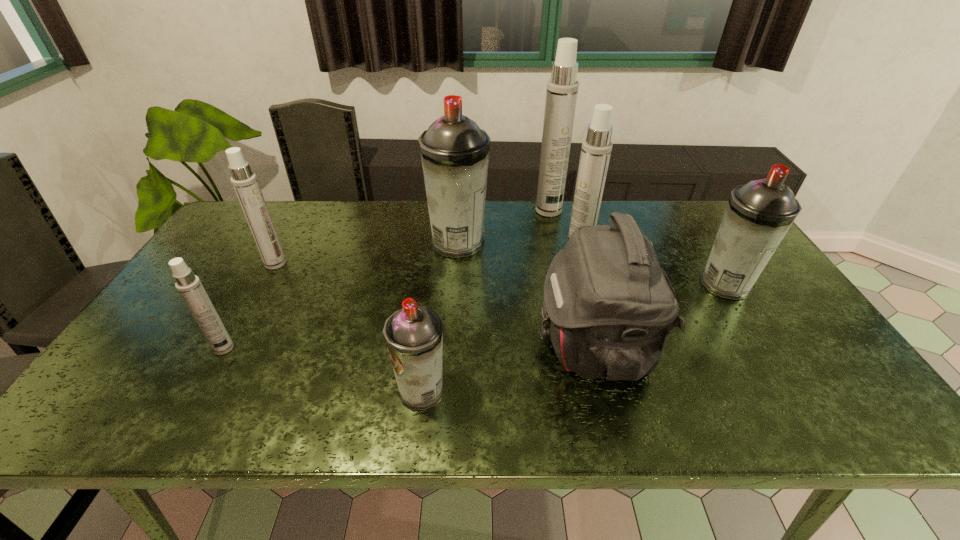
This screenshot has height=540, width=960. I want to click on the smallest gray aerosol can, so click(414, 334).

I want to click on the nearest gray aerosol can, so click(x=414, y=334).

Where is `free space located 0.320m on the right of the farthest white aerosol can`? The height and width of the screenshot is (540, 960). free space located 0.320m on the right of the farthest white aerosol can is located at coordinates (654, 211).

Locate an element on the screen. The image size is (960, 540). free region located 0.300m on the front of the biggest gray aerosol can is located at coordinates (452, 338).

Where is `vacant region located on the left of the second biggest white aerosol can`? vacant region located on the left of the second biggest white aerosol can is located at coordinates (480, 254).

I want to click on free space located on the back of the second biggest gray aerosol can, so click(707, 255).

I want to click on free space located 0.290m on the back of the second smallest white aerosol can, so click(307, 206).

Identify the location of vacant space located 0.320m on the open flap of the gray shoulder bag. Image resolution: width=960 pixels, height=540 pixels. (405, 345).

What are the coordinates of `vacant area situated 0.310m on the open flap of the gray shoulder bag` in the screenshot? It's located at (410, 345).

The width and height of the screenshot is (960, 540). What are the coordinates of `vacant space located 0.250m on the open flap of the gray shoulder bag` in the screenshot? It's located at (434, 345).